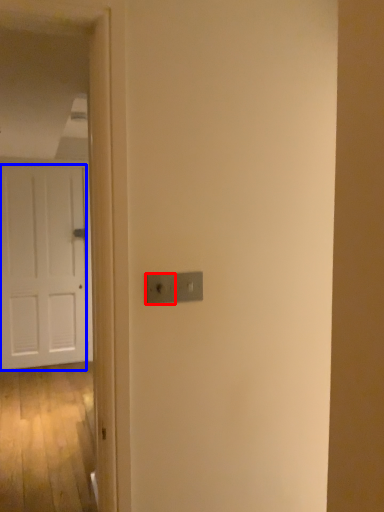
Question: Among these objects, which one is farthest to the camera, light switch (highlighted by a red box) or door (highlighted by a blue box)?

Choices:
 (A) light switch
 (B) door

Answer: (B)